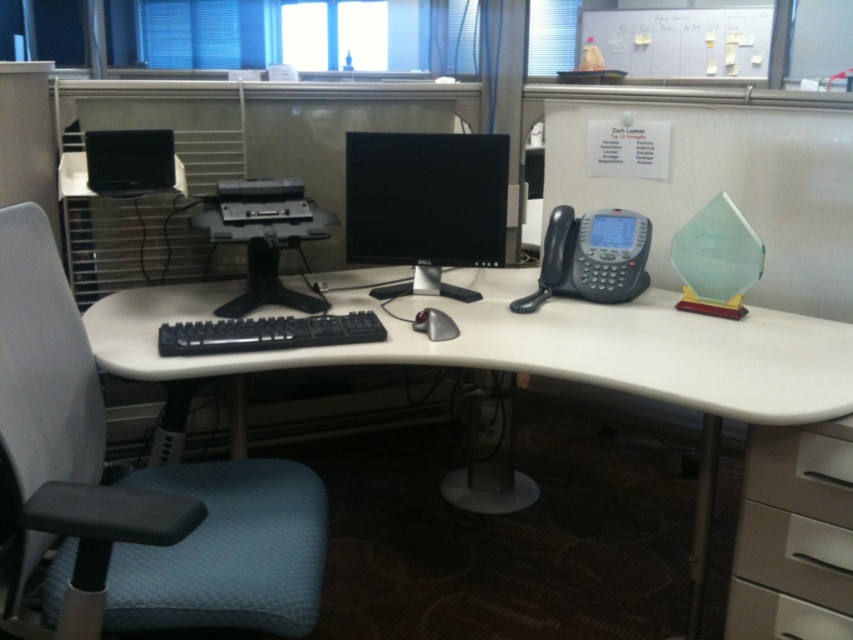
Does beige plastic drawer at lower right have a larger size compared to black glossy monitor at center?

Incorrect, beige plastic drawer at lower right is not larger than black glossy monitor at center.

Which is below, beige plastic drawer at lower right or black glossy monitor at center?

Positioned lower is beige plastic drawer at lower right.

Is point (825, 438) farther from camera compared to point (368, 248)?

No, it is in front of (368, 248).

Image resolution: width=853 pixels, height=640 pixels. I want to click on beige plastic drawer at lower right, so click(793, 536).

Does white plastic desk at center appear on the left side of black plastic desktop computer at center?

No, white plastic desk at center is not to the left of black plastic desktop computer at center.

At what (x,y) coordinates should I click in order to perform the action: click on white plastic desk at center. Please return your answer as a coordinate pair (x, y). This screenshot has height=640, width=853. Looking at the image, I should click on (543, 355).

Who is more forward, (509,358) or (242,205)?

Result: Point (509,358)

At what (x,y) coordinates should I click in order to perform the action: click on white plastic desk at center. Please return your answer as a coordinate pair (x, y). This screenshot has width=853, height=640. Looking at the image, I should click on (543, 355).

Is point (461, 316) less distant than point (450, 324)?

No, (461, 316) is further to viewer.

Which of these two, white plastic desk at center or silver metallic mouse at center, stands shorter?

Standing shorter between the two is silver metallic mouse at center.

Is point (440, 353) positioned behind point (434, 317)?

No, it is not.

I want to click on white plastic desk at center, so click(x=543, y=355).